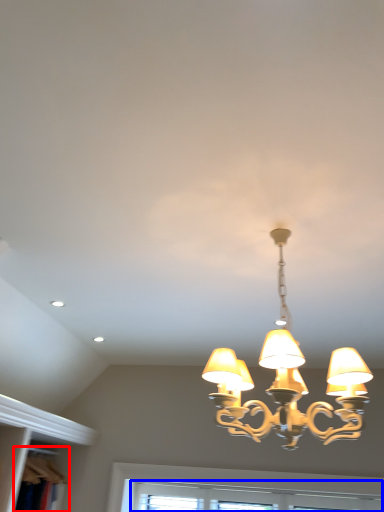
Question: Which object is closer to the camera taking this photo, bookshelf (highlighted by a red box) or window (highlighted by a blue box)?

Choices:
 (A) bookshelf
 (B) window

Answer: (A)